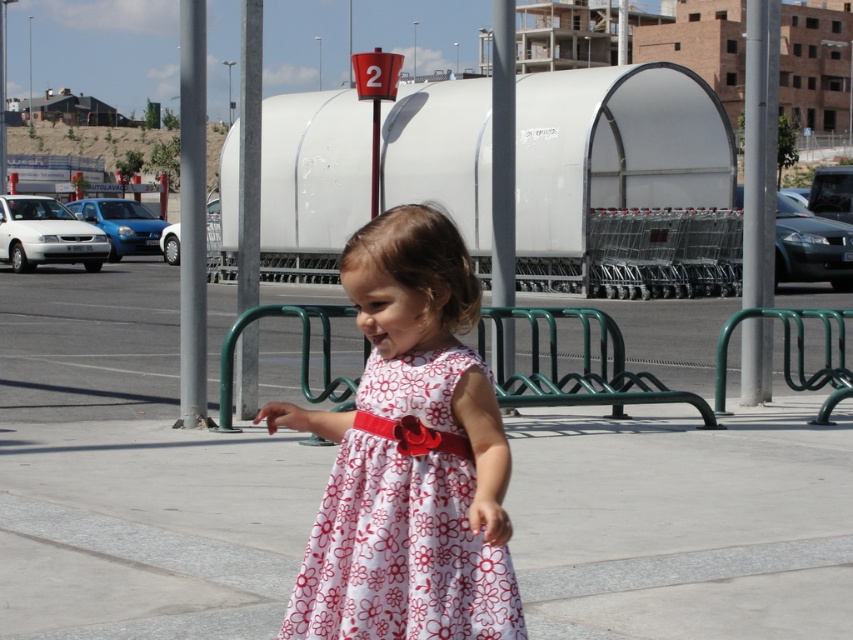
Question: Among these objects, which one is farthest from the camera?

Choices:
 (A) floral cotton dress at center
 (B) white concrete pavement at center

Answer: (B)

Question: Does white concrete pavement at center lie behind floral cotton dress at center?

Choices:
 (A) yes
 (B) no

Answer: (A)

Question: Which point is farther from the camera taking this photo?

Choices:
 (A) (381, 564)
 (B) (831, 608)

Answer: (B)

Question: Can you confirm if white concrete pavement at center is smaller than floral cotton dress at center?

Choices:
 (A) yes
 (B) no

Answer: (B)

Question: Can you confirm if white concrete pavement at center is bigger than floral cotton dress at center?

Choices:
 (A) no
 (B) yes

Answer: (B)